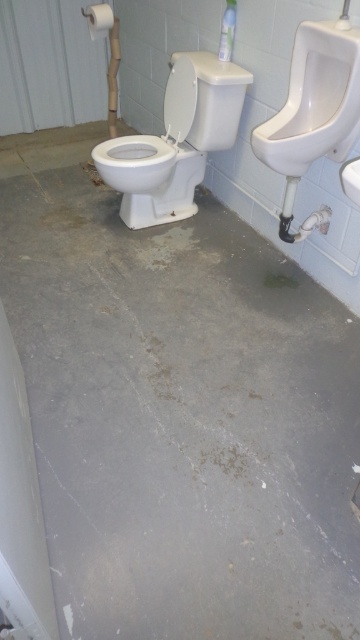
You are standing in the public restroom described. There is a point at coordinates (176,140). Which object from the list below is this point located on? Choose between the white glossy toilet bowl at center and the white urinal on the right.

The point at coordinates (176,140) is located on the white glossy toilet bowl at center.

You are a maintenance worker inspecting the restroom. You notice the white glossy urinal at upper right and the white glossy sink at upper right. Which one has a greater width?

The white glossy urinal at upper right has a greater width than the white glossy sink at upper right.

From the picture: You are standing at point A which is at coordinates point (306,99) and want to move to point B at coordinates point (343,188). Considering the restroom layout described, will you be moving forward or backward?

Since point (306,99) is behind point (343,188), moving from point (306,99) to point (343,188) would mean moving forward towards the direction of point (343,188).